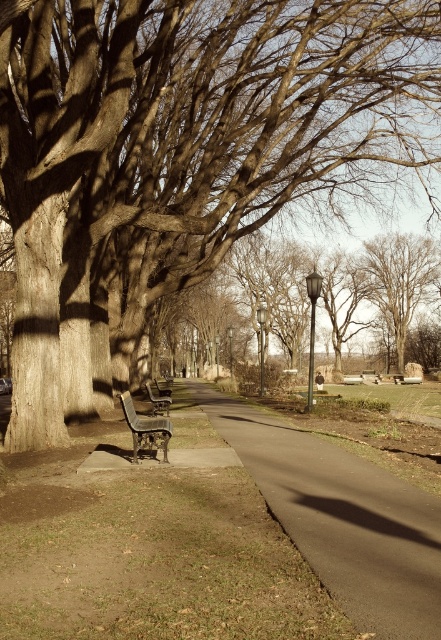
From the picture: Does wooden park bench at center lie behind metallic gray lamp post at center?

No, wooden park bench at center is closer to the viewer.

Does point (157, 408) come in front of point (231, 374)?

That is True.

Measure the distance between wooden park bench at center and camera.

The distance of wooden park bench at center from camera is 17.58 meters.

Locate an element on the screen. wooden park bench at center is located at coordinates (157, 401).

Is rustic wood bench at center further to camera compared to metallic gray lamp post at center?

No.

Which is above, rustic wood bench at center or metallic gray lamp post at center?

Positioned higher is rustic wood bench at center.

This screenshot has height=640, width=441. What are the coordinates of `rustic wood bench at center` in the screenshot? It's located at (145, 429).

Which is in front, point (399, 532) or point (260, 349)?

Point (399, 532) is more forward.

Identify the location of asphalt pavement at center. [343, 518].

Is point (397, 636) in front of point (261, 353)?

Yes.

Identify the location of asphalt pavement at center. The image size is (441, 640). (343, 518).